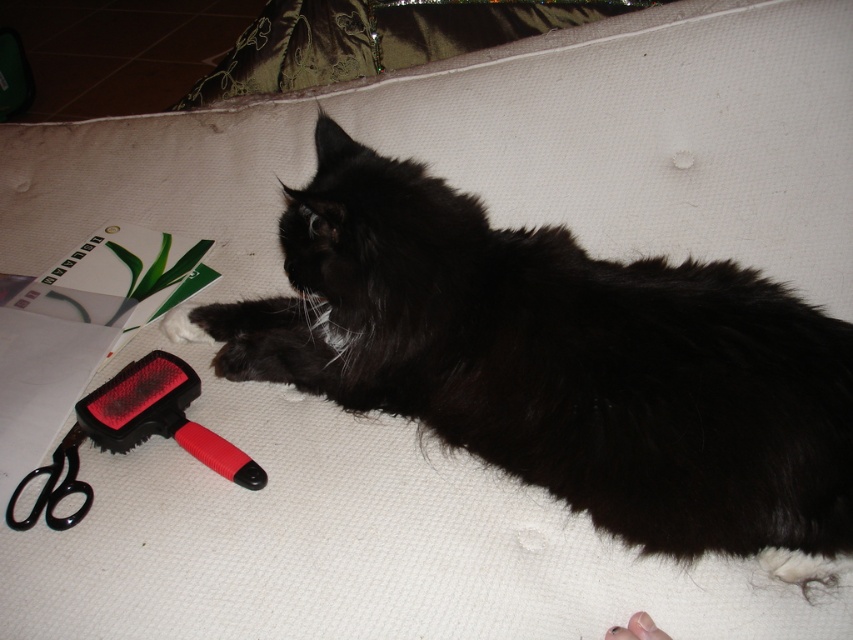
You are standing in front of the image and want to determine which of the two points, point (763, 280) or point (144, 392), is closer to you. Based on the scene, can you identify the closer point?

Point (763, 280) is closer to the viewer than point (144, 392).

You are a photographer trying to capture the perfect shot of the black fluffy cat at center. If your camera is positioned at the origin point, what are the coordinates where you should aim to ensure the cat is centered in the frame?

The coordinates to aim at are exactly where the black fluffy cat at center is located, which is at point (560, 362).